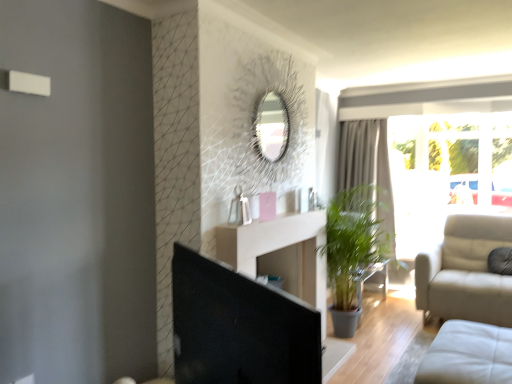
Question: Considering the relative positions of black glossy screen door at center and gray fabric curtain at center in the image provided, is black glossy screen door at center to the left of gray fabric curtain at center from the viewer's perspective?

Choices:
 (A) yes
 (B) no

Answer: (A)

Question: Is black glossy screen door at center thinner than gray fabric curtain at center?

Choices:
 (A) yes
 (B) no

Answer: (A)

Question: Does black glossy screen door at center have a greater height compared to gray fabric curtain at center?

Choices:
 (A) no
 (B) yes

Answer: (A)

Question: Does black glossy screen door at center touch gray fabric curtain at center?

Choices:
 (A) no
 (B) yes

Answer: (A)

Question: Is gray fabric curtain at center at the back of black glossy screen door at center?

Choices:
 (A) yes
 (B) no

Answer: (B)

Question: Is black glossy screen door at center wider or thinner than gray fabric curtain at center?

Choices:
 (A) wide
 (B) thin

Answer: (B)

Question: In terms of height, does black glossy screen door at center look taller or shorter compared to gray fabric curtain at center?

Choices:
 (A) short
 (B) tall

Answer: (A)

Question: Would you say black glossy screen door at center is to the left or to the right of gray fabric curtain at center in the picture?

Choices:
 (A) left
 (B) right

Answer: (A)

Question: From the image's perspective, is black glossy screen door at center located above or below gray fabric curtain at center?

Choices:
 (A) below
 (B) above

Answer: (A)

Question: Considering the positions of black glossy screen door at center and white leather studio couch at lower right in the image, is black glossy screen door at center wider or thinner than white leather studio couch at lower right?

Choices:
 (A) wide
 (B) thin

Answer: (B)

Question: Does point (223, 377) appear closer or farther from the camera than point (477, 374)?

Choices:
 (A) closer
 (B) farther

Answer: (A)

Question: From the image's perspective, is black glossy screen door at center located above or below white leather studio couch at lower right?

Choices:
 (A) above
 (B) below

Answer: (A)

Question: Is black glossy screen door at center taller or shorter than white leather studio couch at lower right?

Choices:
 (A) tall
 (B) short

Answer: (A)

Question: Looking at their shapes, would you say black glossy screen door at center is wider or thinner than transparent glass window at right?

Choices:
 (A) thin
 (B) wide

Answer: (A)

Question: Is black glossy screen door at center taller or shorter than transparent glass window at right?

Choices:
 (A) short
 (B) tall

Answer: (A)